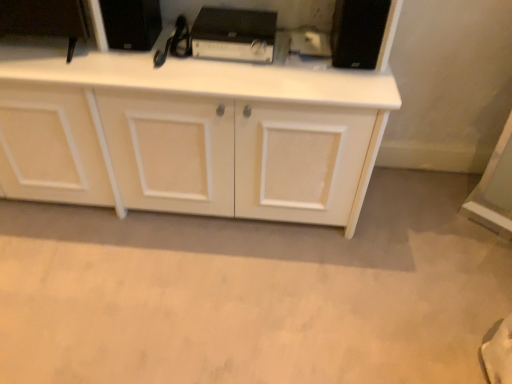
Question: Should I look upward or downward to see black plastic amplifier at center, arranged as the second appliance when viewed from the right?

Choices:
 (A) up
 (B) down

Answer: (A)

Question: Does black plastic amplifier at center, arranged as the second appliance when viewed from the right, appear on the right side of white matte cabinet at center?

Choices:
 (A) yes
 (B) no

Answer: (A)

Question: Is black plastic amplifier at center, arranged as the second appliance when viewed from the right, oriented away from white matte cabinet at center?

Choices:
 (A) yes
 (B) no

Answer: (A)

Question: From the image's perspective, does black plastic amplifier at center, which ranks as the 2th appliance in left-to-right order, appear lower than white matte cabinet at center?

Choices:
 (A) yes
 (B) no

Answer: (B)

Question: Can you confirm if black plastic amplifier at center, arranged as the second appliance when viewed from the right, is shorter than white matte cabinet at center?

Choices:
 (A) no
 (B) yes

Answer: (B)

Question: Could you tell me if black plastic amplifier at center, arranged as the second appliance when viewed from the right, is facing white matte cabinet at center?

Choices:
 (A) no
 (B) yes

Answer: (B)

Question: Is black plastic amplifier at center, arranged as the second appliance when viewed from the right, placed right next to white matte cabinet at center?

Choices:
 (A) no
 (B) yes

Answer: (A)

Question: Is black matte speaker at upper right, positioned as the 1th appliance in right-to-left order, at the right side of black matte speaker at upper center, positioned as the 1th appliance in left-to-right order?

Choices:
 (A) yes
 (B) no

Answer: (A)

Question: Does black matte speaker at upper right, the third appliance in the left-to-right sequence, touch black matte speaker at upper center, which ranks as the third appliance in right-to-left order?

Choices:
 (A) yes
 (B) no

Answer: (B)

Question: Considering the relative sizes of black matte speaker at upper right, positioned as the 1th appliance in right-to-left order, and black matte speaker at upper center, which ranks as the third appliance in right-to-left order, in the image provided, is black matte speaker at upper right, positioned as the 1th appliance in right-to-left order, smaller than black matte speaker at upper center, which ranks as the third appliance in right-to-left order,?

Choices:
 (A) no
 (B) yes

Answer: (A)

Question: Does black matte speaker at upper right, positioned as the 1th appliance in right-to-left order, have a lesser width compared to black matte speaker at upper center, positioned as the 1th appliance in left-to-right order?

Choices:
 (A) yes
 (B) no

Answer: (A)

Question: Considering the relative positions of black matte speaker at upper right, positioned as the 1th appliance in right-to-left order, and black matte speaker at upper center, which ranks as the third appliance in right-to-left order, in the image provided, is black matte speaker at upper right, positioned as the 1th appliance in right-to-left order, behind black matte speaker at upper center, which ranks as the third appliance in right-to-left order,?

Choices:
 (A) yes
 (B) no

Answer: (B)

Question: Would you say black matte speaker at upper right, the third appliance in the left-to-right sequence, is a long distance from black matte speaker at upper center, positioned as the 1th appliance in left-to-right order?

Choices:
 (A) no
 (B) yes

Answer: (A)

Question: Is black matte speaker at upper right, the third appliance in the left-to-right sequence, positioned with its back to white matte cabinet at center?

Choices:
 (A) yes
 (B) no

Answer: (A)